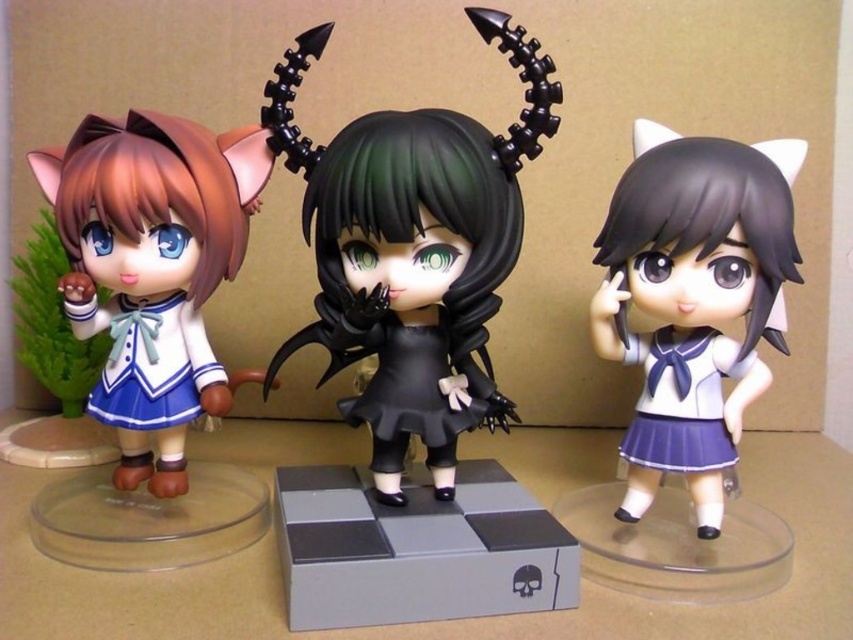
Can you confirm if satin purple skirt at center is shorter than matte blue fabric dress at left?

In fact, satin purple skirt at center may be taller than matte blue fabric dress at left.

Locate an element on the screen. The height and width of the screenshot is (640, 853). satin purple skirt at center is located at coordinates (694, 300).

You are a GUI agent. You are given a task and a screenshot of the screen. Output one action in this format:
    pyautogui.click(x=<x>, y=<y>)
    Task: Click on the satin purple skirt at center
    
    Given the screenshot: What is the action you would take?
    pyautogui.click(x=694, y=300)

Who is more forward, [438,410] or [431,445]?

Point [438,410] is more forward.

Between black matte doll at center and black matte school uniform at center, which one appears on the right side from the viewer's perspective?

Positioned to the right is black matte school uniform at center.

Locate an element on the screen. This screenshot has width=853, height=640. black matte doll at center is located at coordinates pos(413,252).

What are the coordinates of `black matte doll at center` in the screenshot? It's located at (413, 252).

Does point (113, 326) come in front of point (712, 428)?

No, it is not.

Who is higher up, satin blue school uniform at left or satin blue skirt at center?

satin blue school uniform at left is above.

Locate an element on the screen. satin blue school uniform at left is located at coordinates pos(148,360).